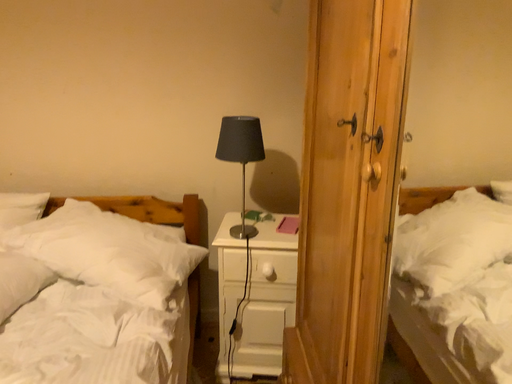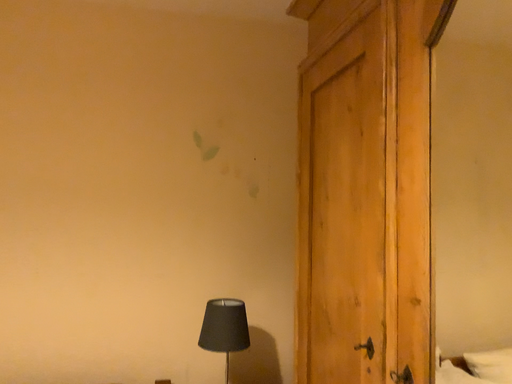
Question: How did the camera likely rotate when shooting the video?

Choices:
 (A) rotated right
 (B) rotated left

Answer: (A)